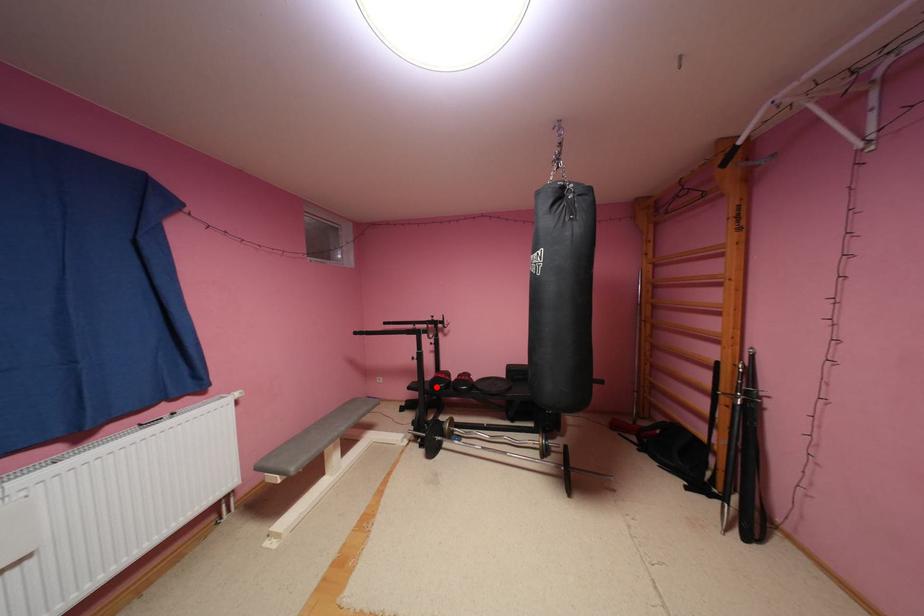
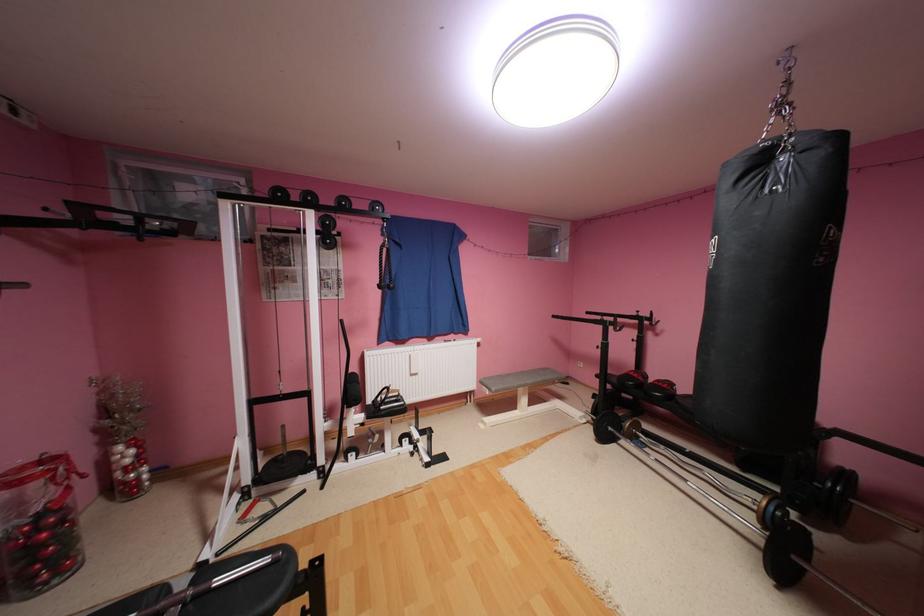
Where in the second image is the point corresponding to the highlighted location from the first image?

(624, 379)